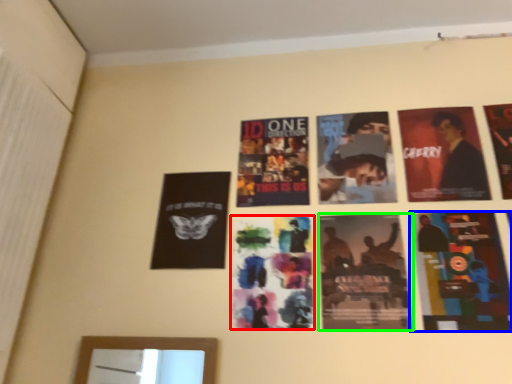
Question: Which object is positioned farthest from poster (highlighted by a red box)? Select from poster (highlighted by a blue box) and poster (highlighted by a green box).

Choices:
 (A) poster
 (B) poster

Answer: (A)